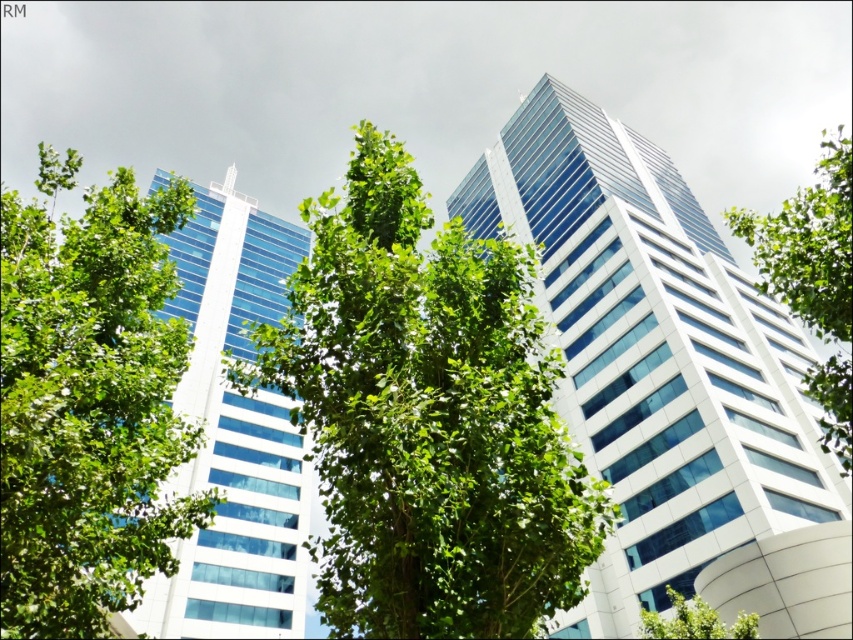
Does green leafy tree at right appear on the left side of green leafy tree at lower right?

No, green leafy tree at right is not to the left of green leafy tree at lower right.

Between point (798, 289) and point (727, 627), which one is positioned in front?

Point (798, 289) is more forward.

Where is `green leafy tree at right`? The image size is (853, 640). green leafy tree at right is located at coordinates (813, 278).

From the picture: Is the position of green leafy tree at left less distant than that of green leafy tree at lower right?

Yes, green leafy tree at left is closer to the viewer.

Describe the element at coordinates (90, 403) in the screenshot. I see `green leafy tree at left` at that location.

Where is `green leafy tree at left`? green leafy tree at left is located at coordinates (90, 403).

The image size is (853, 640). What are the coordinates of `green leafy tree at left` in the screenshot? It's located at (90, 403).

Between green leafy tree at left and glassy blue skyscraper at left, which one appears on the left side from the viewer's perspective?

From the viewer's perspective, glassy blue skyscraper at left appears more on the left side.

Who is more distant from viewer, (x=45, y=600) or (x=146, y=611)?

The point (x=146, y=611) is behind.

The height and width of the screenshot is (640, 853). I want to click on green leafy tree at left, so click(90, 403).